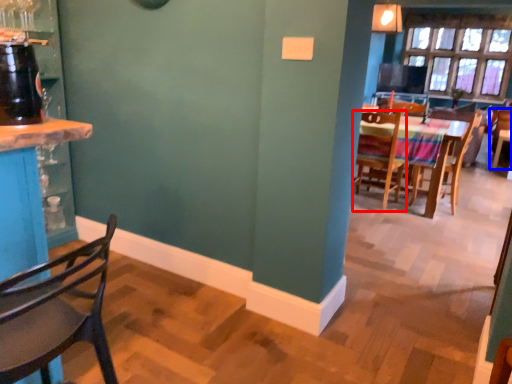
Question: Which object is closer to the camera taking this photo, chair (highlighted by a red box) or chair (highlighted by a blue box)?

Choices:
 (A) chair
 (B) chair

Answer: (A)